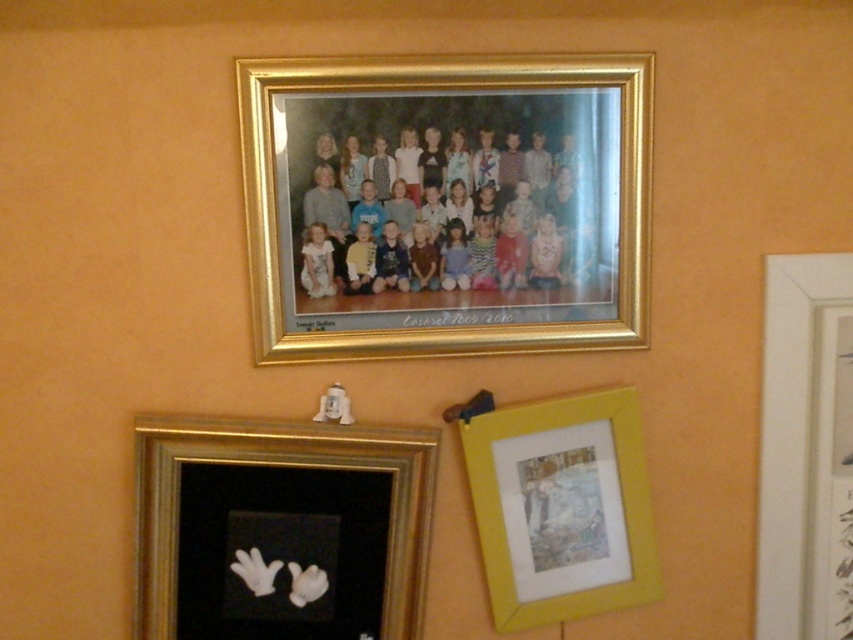
Does gold metallic photo frame at upper center have a lesser width compared to white matte picture frame at upper right?

No, gold metallic photo frame at upper center is not thinner than white matte picture frame at upper right.

Between gold metallic photo frame at upper center and white matte picture frame at upper right, which one has more height?

Standing taller between the two is white matte picture frame at upper right.

Is point (577, 202) closer to viewer compared to point (839, 410)?

Yes.

You are a GUI agent. You are given a task and a screenshot of the screen. Output one action in this format:
    pyautogui.click(x=<x>, y=<y>)
    Task: Click on the gold metallic photo frame at upper center
    
    Given the screenshot: What is the action you would take?
    pyautogui.click(x=445, y=204)

Who is positioned more to the right, black velvet gloves at lower left or white matte picture frame at upper right?

white matte picture frame at upper right is more to the right.

Is black velvet gloves at lower left shorter than white matte picture frame at upper right?

Indeed, black velvet gloves at lower left has a lesser height compared to white matte picture frame at upper right.

The height and width of the screenshot is (640, 853). I want to click on black velvet gloves at lower left, so click(x=281, y=529).

Is gold metallic photo frame at upper center below black velvet gloves at lower left?

Actually, gold metallic photo frame at upper center is above black velvet gloves at lower left.

Is gold metallic photo frame at upper center positioned behind black velvet gloves at lower left?

No.

Measure the distance between point (602,122) and camera.

Point (602,122) and camera are 1.35 meters apart.

At what (x,y) coordinates should I click in order to perform the action: click on gold metallic photo frame at upper center. Please return your answer as a coordinate pair (x, y). The height and width of the screenshot is (640, 853). Looking at the image, I should click on (445, 204).